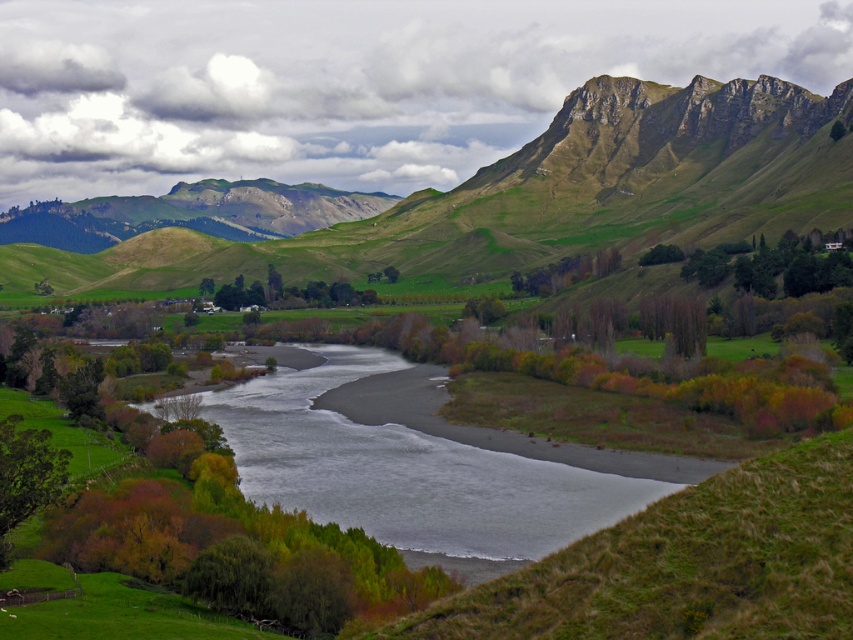
Question: Is green leafy tree at center thinner than green matte tree at center?

Choices:
 (A) no
 (B) yes

Answer: (B)

Question: Which point is farther to the camera?

Choices:
 (A) gray sand river at center
 (B) green matte tree at center

Answer: (B)

Question: Which is nearer to the green matte tree at center?

Choices:
 (A) green leafy tree at center
 (B) green matte tree at lower left
 (C) green grassy hill at upper center

Answer: (C)

Question: Is green grassy mountain at upper center below green matte tree at center?

Choices:
 (A) no
 (B) yes

Answer: (A)

Question: Among these objects, which one is farthest from the camera?

Choices:
 (A) green leafy tree at center
 (B) green grassy mountain at upper center

Answer: (B)

Question: Does gray sand river at center lie in front of green matte tree at lower left?

Choices:
 (A) no
 (B) yes

Answer: (A)